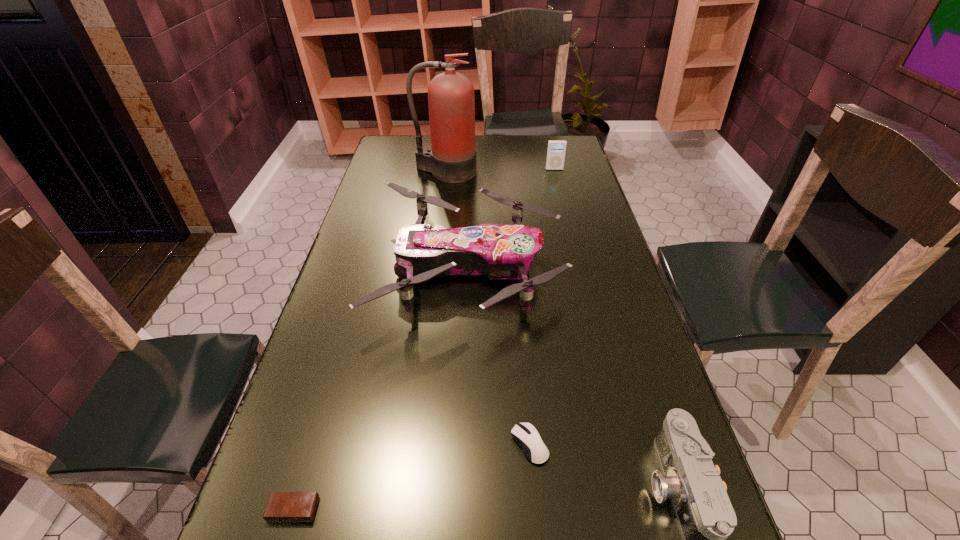
The height and width of the screenshot is (540, 960). I want to click on fire extinguisher, so click(x=451, y=100).

At what (x,y) coordinates should I click in order to perform the action: click on the fourth nearest object. Please return your answer as a coordinate pair (x, y). The width and height of the screenshot is (960, 540). Looking at the image, I should click on tap(499, 251).

You are a GUI agent. You are given a task and a screenshot of the screen. Output one action in this format:
    pyautogui.click(x=<x>, y=<y>)
    Task: Click on the iPod
    The height and width of the screenshot is (540, 960).
    Given the screenshot: What is the action you would take?
    pyautogui.click(x=556, y=150)

Identify the location of the fifth tallest object. The height and width of the screenshot is (540, 960). (526, 435).

Locate an element on the screen. The height and width of the screenshot is (540, 960). the shortest object is located at coordinates [282, 506].

You are a GUI agent. You are given a task and a screenshot of the screen. Output one action in this format:
    pyautogui.click(x=<x>, y=<y>)
    Task: Click on the vacant position located at the nozzle of the tallest object
    
    Given the screenshot: What is the action you would take?
    pyautogui.click(x=441, y=211)

Where is `free space located 0.100m on the front-facing side of the drone`? This screenshot has height=540, width=960. free space located 0.100m on the front-facing side of the drone is located at coordinates (596, 268).

Locate an element on the screen. This screenshot has width=960, height=540. blank space located on the front-facing side of the iPod is located at coordinates [x=565, y=213].

You are a GUI agent. You are given a task and a screenshot of the screen. Output one action in this format:
    pyautogui.click(x=<x>, y=<y>)
    Task: Click on the blank space located on the left of the mouse
    This screenshot has height=540, width=960.
    Given the screenshot: What is the action you would take?
    pyautogui.click(x=345, y=444)

Where is `object positioned at the far edge`? object positioned at the far edge is located at coordinates (451, 100).